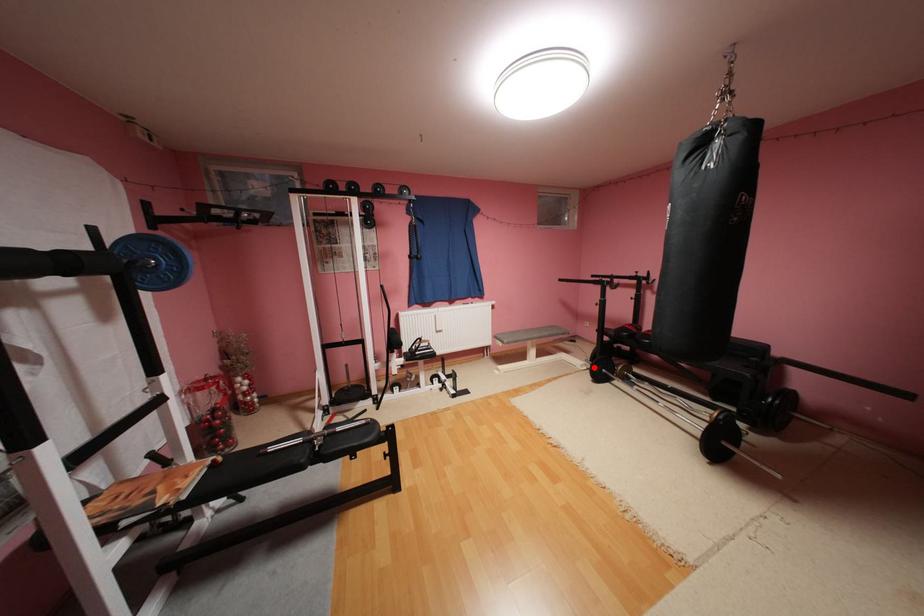
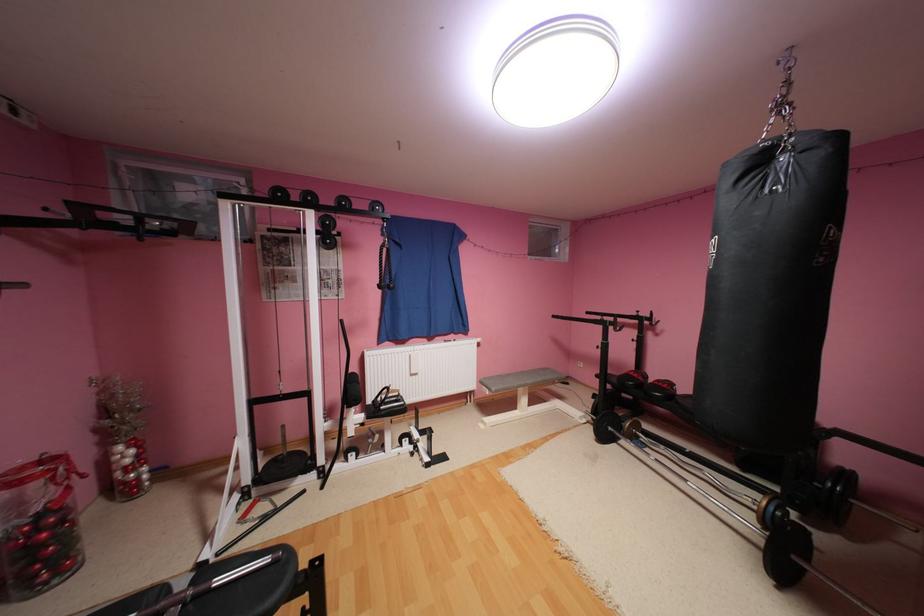
In the second image, find the point that corresponds to the highlighted location in the first image.

(593, 419)